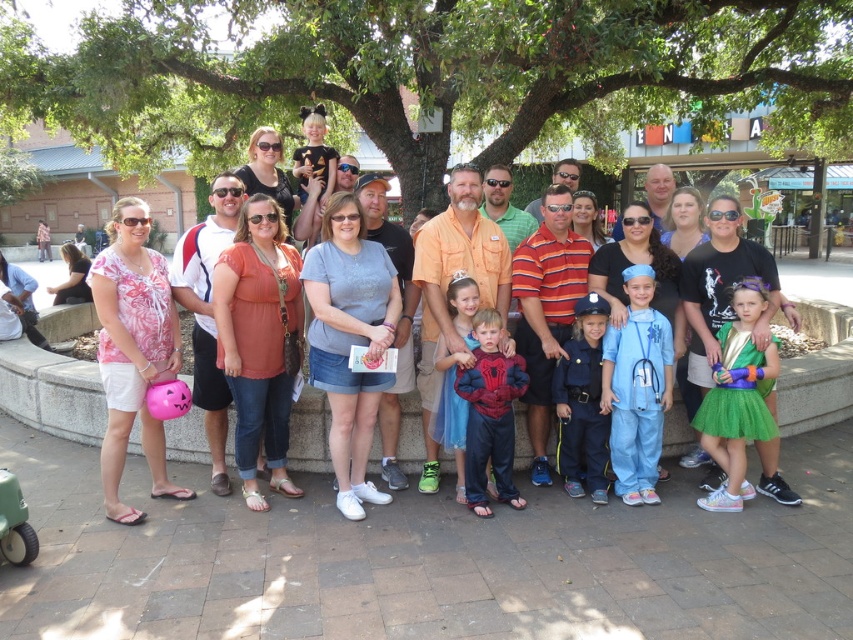
Based on the photo, does green leafy tree at upper center have a smaller size compared to blue cotton scrubs at center?

Incorrect, green leafy tree at upper center is not smaller in size than blue cotton scrubs at center.

Is point (10, 1) closer to camera compared to point (659, 419)?

No, it is not.

Is point (822, 44) closer to viewer compared to point (605, 406)?

No, it is not.

The height and width of the screenshot is (640, 853). I want to click on green leafy tree at upper center, so click(x=434, y=74).

Between point (380, 412) and point (712, 436), which one is positioned behind?

The point (380, 412) is more distant.

Can you confirm if matte pink pumpkin bucket at left is positioned above green tulle dress at center?

Indeed, matte pink pumpkin bucket at left is positioned over green tulle dress at center.

Which is behind, point (183, 294) or point (735, 429)?

The point (183, 294) is behind.

At what (x,y) coordinates should I click in order to perform the action: click on matte pink pumpkin bucket at left. Please return your answer as a coordinate pair (x, y). The height and width of the screenshot is (640, 853). Looking at the image, I should click on (465, 241).

Is striped polo shirt at center to the right of shiny blue costume at center from the viewer's perspective?

Indeed, striped polo shirt at center is positioned on the right side of shiny blue costume at center.

Is point (553, 323) positioned behind point (488, 432)?

Yes, point (553, 323) is farther from viewer.

The height and width of the screenshot is (640, 853). Find the location of `striped polo shirt at center`. striped polo shirt at center is located at coordinates (546, 308).